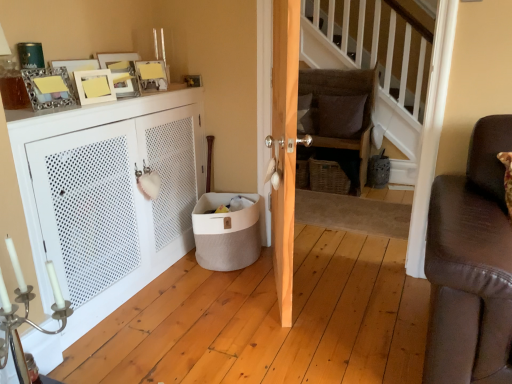
Question: Does point (346, 129) appear closer or farther from the camera than point (58, 61)?

Choices:
 (A) closer
 (B) farther

Answer: (B)

Question: Is brown fabric pillow at center, marked as the 2th pillow in a left-to-right arrangement, inside the boundaries of matte gold picture frame at upper left, the third picture frame viewed from the back, or outside?

Choices:
 (A) inside
 (B) outside

Answer: (B)

Question: Which object is the closest to the metallic silver picture frame at upper left, the 2th picture frame positioned from the right?

Choices:
 (A) matte yellow picture frame at upper left, the 4th picture frame when ordered from back to front
 (B) textured brown cushion at center
 (C) wooden door at center
 (D) brown fabric pillow at center, marked as the 2th pillow in a left-to-right arrangement
 (E) white matte cabinet at left

Answer: (A)

Question: Which object is the closest to the wooden staircase at center?

Choices:
 (A) white matte cabinet at left
 (B) wooden door at center
 (C) matte gold picture frame at upper left, the third picture frame viewed from the back
 (D) matte yellow picture frame at upper left, the 4th picture frame when ordered from back to front
 (E) textured brown cushion at center

Answer: (E)